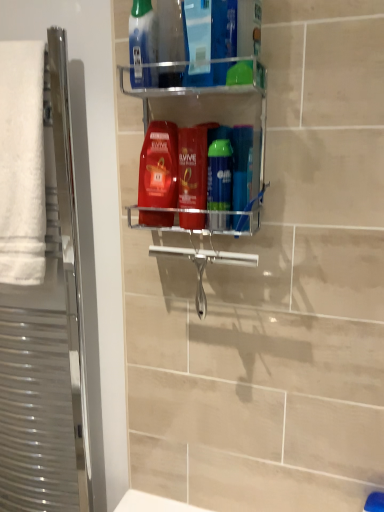
Question: In which direction should I rotate to look at translucent plastic mouthwash at upper center, placed as the first mouthwash when sorted from left to right?

Choices:
 (A) right
 (B) left

Answer: (B)

Question: From a real-world perspective, is shiny red shampoo at center located higher than blue plastic toothbrush at center, placed as the first mouthwash when sorted from right to left?

Choices:
 (A) yes
 (B) no

Answer: (A)

Question: Can you confirm if shiny red shampoo at center is bigger than blue plastic toothbrush at center, placed as the first mouthwash when sorted from right to left?

Choices:
 (A) yes
 (B) no

Answer: (A)

Question: Is shiny red shampoo at center behind blue plastic toothbrush at center, the 4th mouthwash from the left?

Choices:
 (A) no
 (B) yes

Answer: (B)

Question: Is shiny red shampoo at center far away from blue plastic toothbrush at center, placed as the first mouthwash when sorted from right to left?

Choices:
 (A) yes
 (B) no

Answer: (B)

Question: Is shiny red shampoo at center shorter than blue plastic toothbrush at center, the 4th mouthwash from the left?

Choices:
 (A) yes
 (B) no

Answer: (B)

Question: Is shiny red shampoo at center wider than blue plastic toothbrush at center, placed as the first mouthwash when sorted from right to left?

Choices:
 (A) yes
 (B) no

Answer: (A)

Question: Is green glossy mouthwash at center, the 3th mouthwash viewed from the left, bigger than shiny red shampoo at center?

Choices:
 (A) yes
 (B) no

Answer: (B)

Question: Is green glossy mouthwash at center, the 3th mouthwash viewed from the left, positioned beyond the bounds of shiny red shampoo at center?

Choices:
 (A) yes
 (B) no

Answer: (A)

Question: Does green glossy mouthwash at center, the 3th mouthwash viewed from the left, have a lesser width compared to shiny red shampoo at center?

Choices:
 (A) no
 (B) yes

Answer: (B)

Question: From a real-world perspective, is green glossy mouthwash at center, which appears as the 2th mouthwash when viewed from the right, physically below shiny red shampoo at center?

Choices:
 (A) no
 (B) yes

Answer: (B)

Question: Is the depth of green glossy mouthwash at center, the 3th mouthwash viewed from the left, greater than that of shiny red shampoo at center?

Choices:
 (A) no
 (B) yes

Answer: (A)

Question: Is shiny red shampoo at center at the back of green glossy mouthwash at center, which appears as the 2th mouthwash when viewed from the right?

Choices:
 (A) yes
 (B) no

Answer: (B)

Question: Is silver metallic towel rack at left bigger than green glossy mouthwash at center, which appears as the 2th mouthwash when viewed from the right?

Choices:
 (A) no
 (B) yes

Answer: (B)